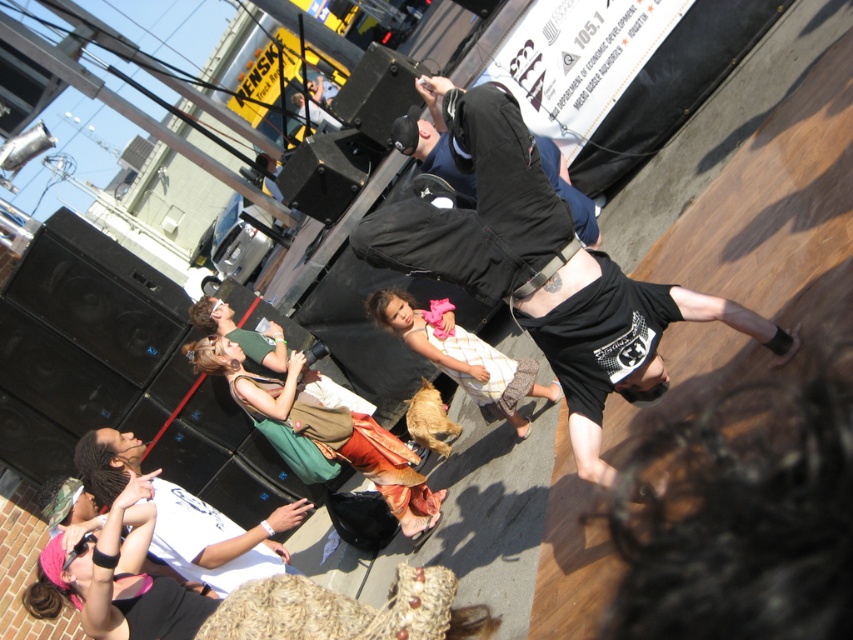
Is point (596, 364) positioned in front of point (289, 525)?

Yes, it is in front of point (289, 525).

Locate an element on the screen. black cotton t-shirt at center is located at coordinates (544, 272).